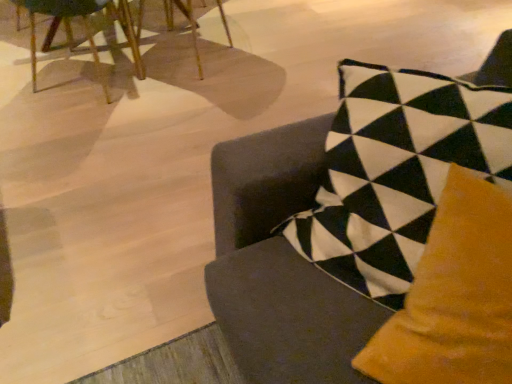
Locate an element on the screen. free space in front of wooden chair at upper left, which is the third chair in right-to-left order is located at coordinates (65, 131).